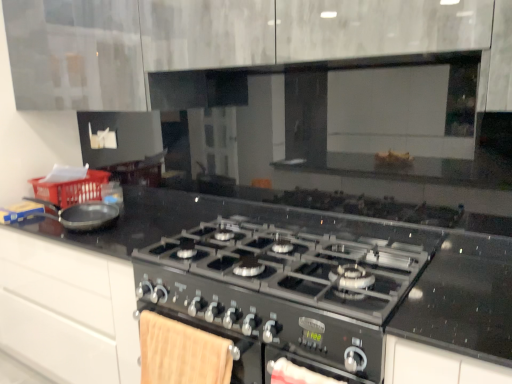
Describe the element at coordinates (71, 189) in the screenshot. I see `red plastic basket at left` at that location.

Locate an element on the screen. red plastic basket at left is located at coordinates (71, 189).

What do you see at coordinates (81, 215) in the screenshot? I see `matte black frying pan at left` at bounding box center [81, 215].

Image resolution: width=512 pixels, height=384 pixels. What are the coordinates of `red plastic basket at left` in the screenshot? It's located at (71, 189).

From a real-world perspective, between black metallic gas stove at center and matte black frying pan at left, who is vertically lower?

black metallic gas stove at center is physically lower.

Which of these two, black metallic gas stove at center or matte black frying pan at left, is bigger?

black metallic gas stove at center.

Considering the relative positions of black metallic gas stove at center and matte black frying pan at left in the image provided, is black metallic gas stove at center to the left or to the right of matte black frying pan at left?

In the image, black metallic gas stove at center appears on the right side of matte black frying pan at left.

Is black metallic gas stove at center shorter than matte black frying pan at left?

No.

Does red plastic basket at left touch matte black frying pan at left?

No, red plastic basket at left is not making contact with matte black frying pan at left.

Considering the relative positions of red plastic basket at left and matte black frying pan at left in the image provided, is red plastic basket at left to the left of matte black frying pan at left from the viewer's perspective?

Indeed, red plastic basket at left is positioned on the left side of matte black frying pan at left.

Is point (98, 196) farther from viewer compared to point (72, 206)?

Yes, it is.

Is red plastic basket at left closer to camera compared to matte black frying pan at left?

No, it is not.

Which is closer to the camera, (96, 203) or (332, 253)?

Point (96, 203) appears to be farther away from the viewer than point (332, 253).

Does matte black frying pan at left turn towards black metallic gas stove at center?

No.

In the scene shown: Is matte black frying pan at left not near black metallic gas stove at center?

No, there isn't a large distance between matte black frying pan at left and black metallic gas stove at center.

Looking at this image, measure the distance between matte black frying pan at left and black metallic gas stove at center.

32.42 inches.

Measure the distance from red plastic basket at left to black metallic gas stove at center.

3.85 feet.

Could you tell me if red plastic basket at left is facing black metallic gas stove at center?

No, red plastic basket at left is not turned towards black metallic gas stove at center.

Which object is further away from the camera, red plastic basket at left or black metallic gas stove at center?

red plastic basket at left is further from the camera.

Consider the image. From the image's perspective, is red plastic basket at left under black metallic gas stove at center?

Actually, red plastic basket at left appears above black metallic gas stove at center in the image.

Which of these two, black metallic gas stove at center or red plastic basket at left, is bigger?

black metallic gas stove at center is bigger.

Considering the relative positions of black metallic gas stove at center and red plastic basket at left in the image provided, is black metallic gas stove at center to the left of red plastic basket at left from the viewer's perspective?

Incorrect, black metallic gas stove at center is not on the left side of red plastic basket at left.

Image resolution: width=512 pixels, height=384 pixels. Identify the location of gas stove in front of the red plastic basket at left. (278, 270).

Consider the image. Is black metallic gas stove at center oriented towards red plastic basket at left?

No, black metallic gas stove at center is not turned towards red plastic basket at left.

Is red plastic basket at left surrounded by matte black frying pan at left?

No, red plastic basket at left is located outside of matte black frying pan at left.

Considering the sizes of objects matte black frying pan at left and red plastic basket at left in the image provided, who is wider, matte black frying pan at left or red plastic basket at left?

red plastic basket at left is wider.

Between matte black frying pan at left and red plastic basket at left, which one has smaller size?

matte black frying pan at left.

From the image's perspective, is matte black frying pan at left located above or below red plastic basket at left?

Based on their image positions, matte black frying pan at left is located beneath red plastic basket at left.

The height and width of the screenshot is (384, 512). In order to click on gas stove below the matte black frying pan at left (from a real-world perspective) in this screenshot , I will do `click(278, 270)`.

Locate an element on the screen. basket lying behind the matte black frying pan at left is located at coordinates (71, 189).

Looking at this image, when comparing their distances from red plastic basket at left, does matte black frying pan at left or black metallic gas stove at center seem closer?

matte black frying pan at left lies closer to red plastic basket at left than the other object.

Estimate the real-world distances between objects in this image. Which object is closer to matte black frying pan at left, red plastic basket at left or black metallic gas stove at center?

Based on the image, red plastic basket at left appears to be nearer to matte black frying pan at left.

Which object lies further to the anchor point black metallic gas stove at center, red plastic basket at left or matte black frying pan at left?

red plastic basket at left is positioned further to the anchor black metallic gas stove at center.

Based on the photo, based on their spatial positions, is black metallic gas stove at center or red plastic basket at left closer to matte black frying pan at left?

red plastic basket at left lies closer to matte black frying pan at left than the other object.

Which object lies nearer to the anchor point black metallic gas stove at center, matte black frying pan at left or red plastic basket at left?

Among the two, matte black frying pan at left is located nearer to black metallic gas stove at center.

When comparing their distances from red plastic basket at left, does black metallic gas stove at center or matte black frying pan at left seem closer?

matte black frying pan at left.

What are the coordinates of `kitchen appliance between red plastic basket at left and black metallic gas stove at center from left to right` in the screenshot? It's located at (81, 215).